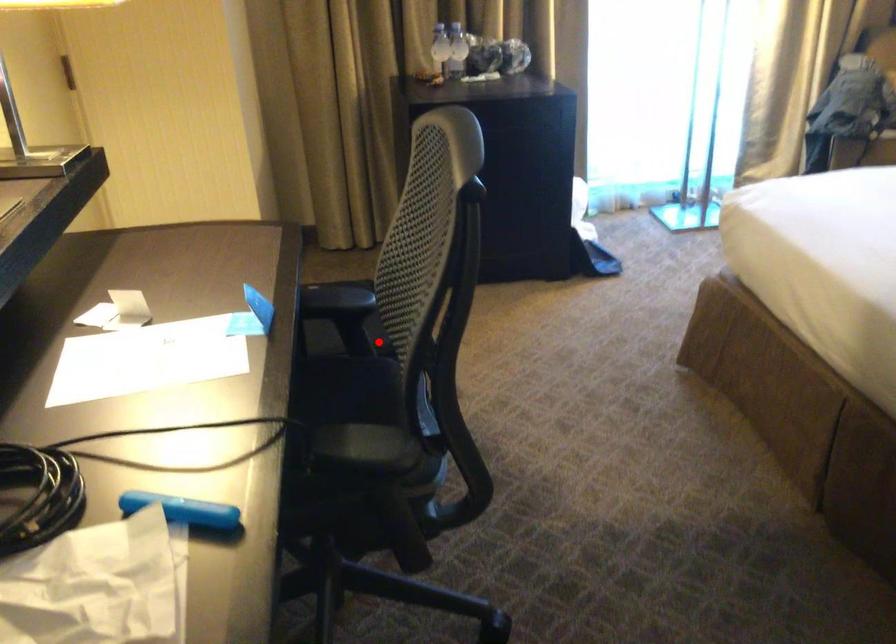
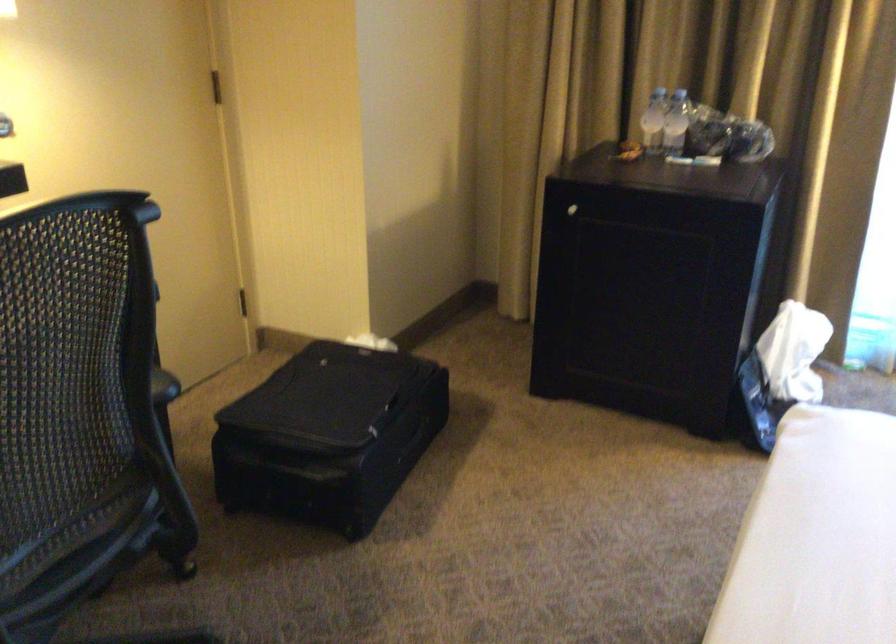
The point at the highlighted location is marked in the first image. Where is the corresponding point in the second image?

(329, 436)